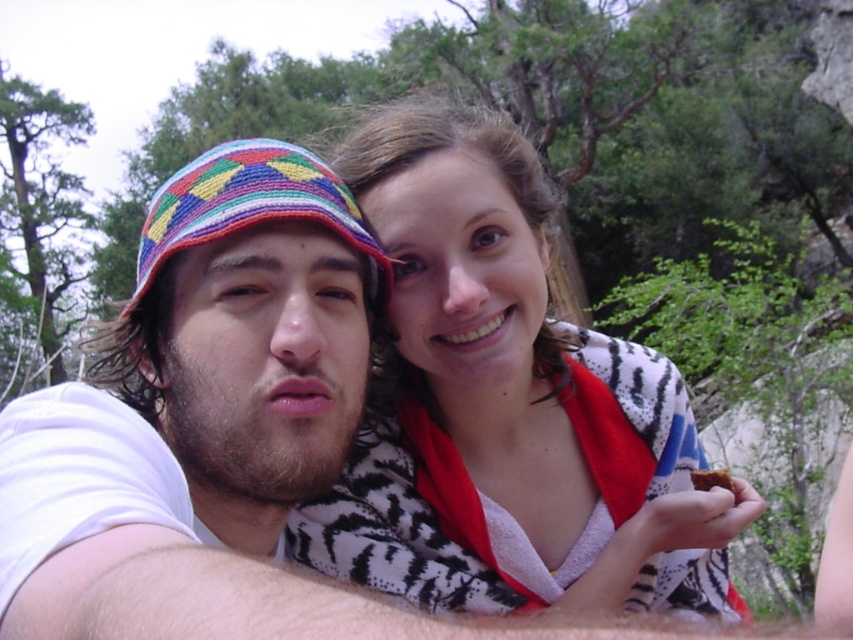
Consider the image. You are a photographer trying to capture a closeup of the brown crumbly bread at lower right without including the beaded fabric hat at left in the shot. Based on their positions, is this possible?

The beaded fabric hat at left is in front of the brown crumbly bread at lower right, so it is blocking the view. To capture a closeup of the brown crumbly bread at lower right without the hat, you would need to reposition the camera or move the hat out of the way.

From the picture: You are a photographer trying to capture a clear shot of both the multicolored woven hat at center and the beaded fabric hat at left. Given their positions, which hat should you focus on first to ensure both are in frame without obstruction?

The multicolored woven hat at center is in front of the beaded fabric hat at left, so you should focus on the beaded fabric hat at left first to ensure it doesn not get blocked by the front hat.

You are standing in a park and see two points marked in the image. You want to place a small flag at the point that is closer to you. Which point should you choose between point [181,180] and point [239,205]?

Point [239,205] is closer to you, so you should place the flag there.